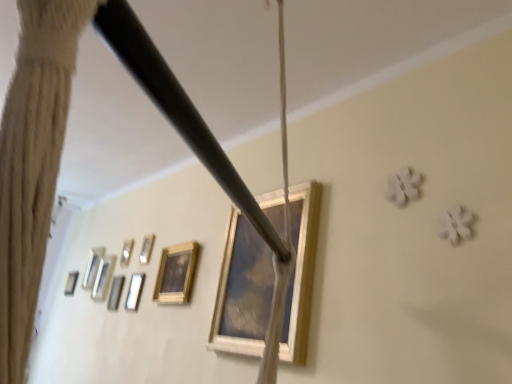
Question: Is metallic silver picture frame at upper left, placed as the 4th picture frame when sorted from back to front, bigger or smaller than wooden picture frame at center, the 1th picture frame in the right-to-left sequence?

Choices:
 (A) small
 (B) big

Answer: (A)

Question: Considering the relative positions of metallic silver picture frame at upper left, which is the third picture frame from right to left, and wooden picture frame at center, the seventh picture frame positioned from the left, in the image provided, is metallic silver picture frame at upper left, which is the third picture frame from right to left, to the left or to the right of wooden picture frame at center, the seventh picture frame positioned from the left,?

Choices:
 (A) left
 (B) right

Answer: (A)

Question: Which of these objects is positioned farthest from the wooden picture frame at lower left, which appears as the 2th picture frame when viewed from the front?

Choices:
 (A) metallic silver picture frame at upper left, which appears as the fifth picture frame when viewed from the back
 (B) wooden picture frame at left, the third picture frame positioned from the back
 (C) wooden picture frame at left, which is the 1th picture frame in left-to-right order
 (D) metallic silver picture frame at upper left, the fourth picture frame positioned from the front
 (E) wooden picture frame at center, the seventh picture frame positioned from the left

Answer: (C)

Question: Estimate the real-world distances between objects in this image. Which object is farther from the wooden picture frame at center, the seventh picture frame positioned from the left?

Choices:
 (A) wooden picture frame at lower left, which is the second picture frame in right-to-left order
 (B) metallic silver picture frame at upper left, the fourth picture frame from the right
 (C) wooden picture frame at left, which is the 1th picture frame in left-to-right order
 (D) metallic silver picture frame at upper left, the fourth picture frame positioned from the front
 (E) wooden picture frame at left, which is the third picture frame in left-to-right order

Answer: (C)